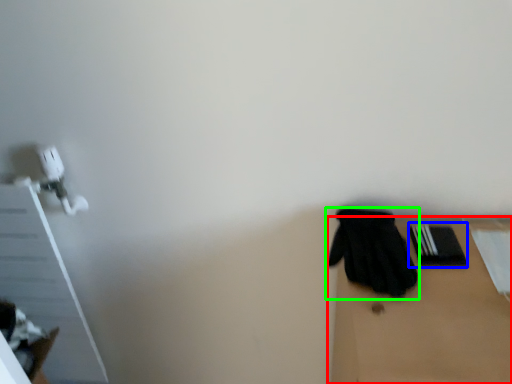
Question: Based on their relative distances, which object is nearer to table (highlighted by a red box)? Choose from bin (highlighted by a blue box) and glove (highlighted by a green box).

Choices:
 (A) bin
 (B) glove

Answer: (B)